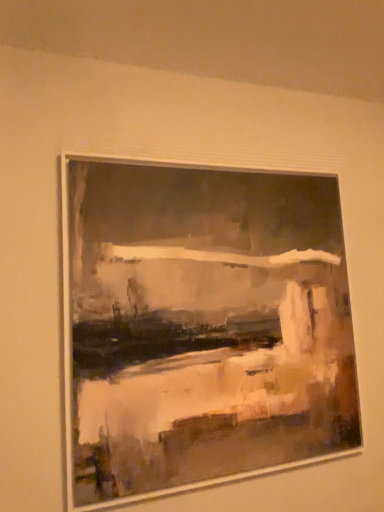
This screenshot has width=384, height=512. What do you see at coordinates (201, 326) in the screenshot?
I see `matte white picture frame at center` at bounding box center [201, 326].

Measure the distance between point (185, 417) and camera.

Point (185, 417) and camera are 1.19 meters apart.

What is the approximate height of matte white picture frame at center?

matte white picture frame at center is 38.84 inches in height.

Find the location of a particular element. This screenshot has height=512, width=384. matte white picture frame at center is located at coordinates (201, 326).

Locate an element on the screen. Image resolution: width=384 pixels, height=512 pixels. matte white picture frame at center is located at coordinates (201, 326).